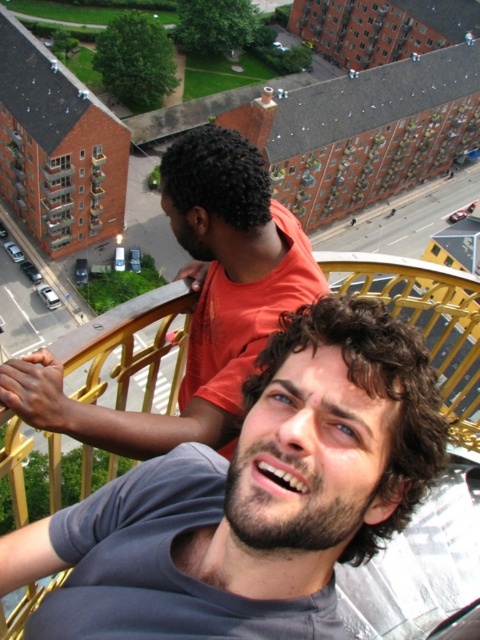
Is point (255, 461) positioned in front of point (308, 252)?

That is True.

In the scene shown: Is gray cotton shirt at center thinner than gray fabric shirt at center?

No.

Locate an element on the screen. gray cotton shirt at center is located at coordinates (252, 497).

Where is `gray cotton shirt at center`? This screenshot has width=480, height=640. gray cotton shirt at center is located at coordinates (252, 497).